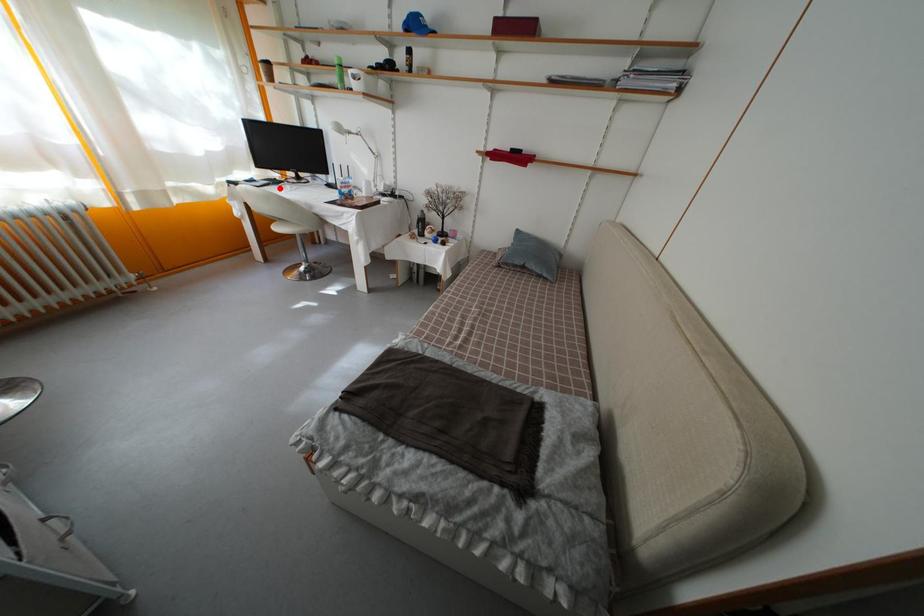
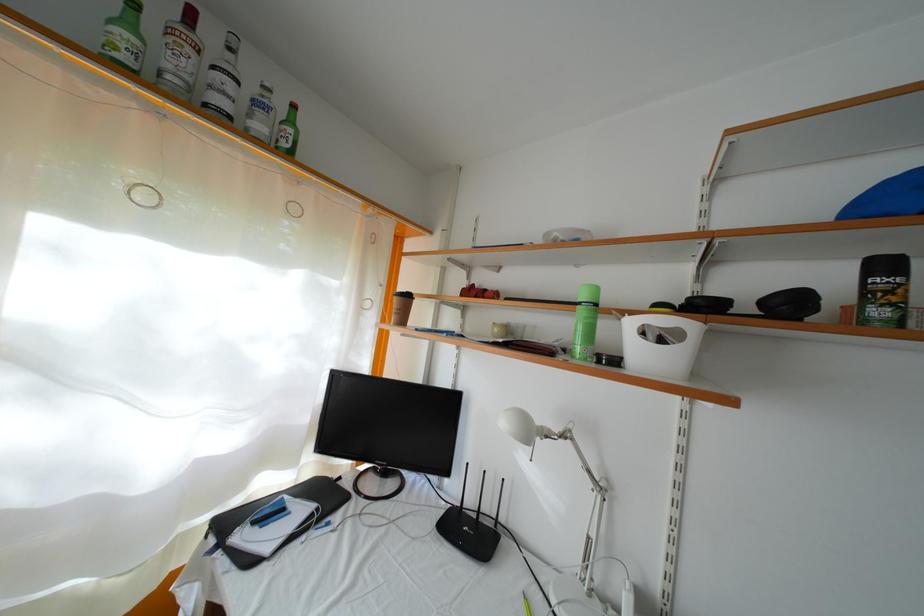
Locate, in the second image, the point that corresponds to the highlighted location in the first image.

(334, 506)